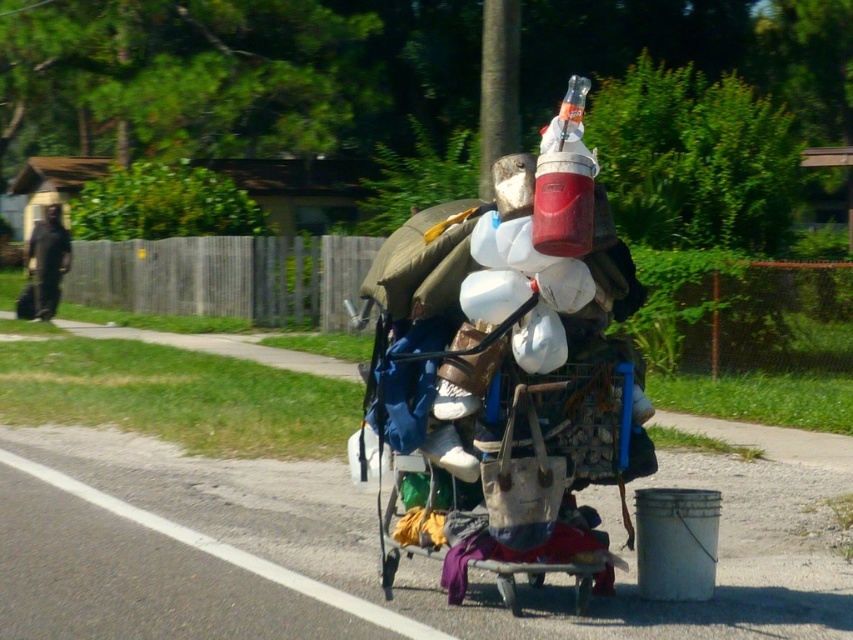
Which is more to the left, rusty metal cart at center or black fabric bag at left?

black fabric bag at left

Is point (601, 556) more distant than point (41, 260)?

No.

This screenshot has width=853, height=640. Identify the location of rusty metal cart at center. (520, 476).

This screenshot has width=853, height=640. I want to click on rusty metal cart at center, so click(520, 476).